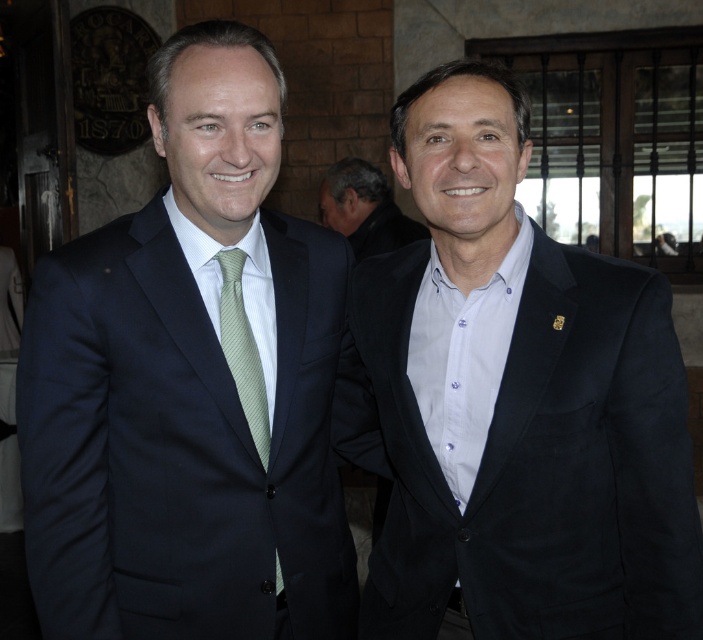
Question: Which point appears farthest from the camera in this image?

Choices:
 (A) pos(389,248)
 (B) pos(198,400)

Answer: (A)

Question: Which point is closer to the camera taking this photo?

Choices:
 (A) (333, 470)
 (B) (366, 230)

Answer: (A)

Question: Observing the image, what is the correct spatial positioning of matte black suit at right in reference to dark brown hair at center?

Choices:
 (A) below
 (B) above

Answer: (A)

Question: Which object is farther from the camera taking this photo?

Choices:
 (A) matte black suit at left
 (B) green striped tie at center

Answer: (B)

Question: Is matte black suit at left to the right of matte black suit at right from the viewer's perspective?

Choices:
 (A) yes
 (B) no

Answer: (B)

Question: Considering the relative positions of matte black suit at right and green striped tie at center in the image provided, where is matte black suit at right located with respect to green striped tie at center?

Choices:
 (A) right
 (B) left

Answer: (A)